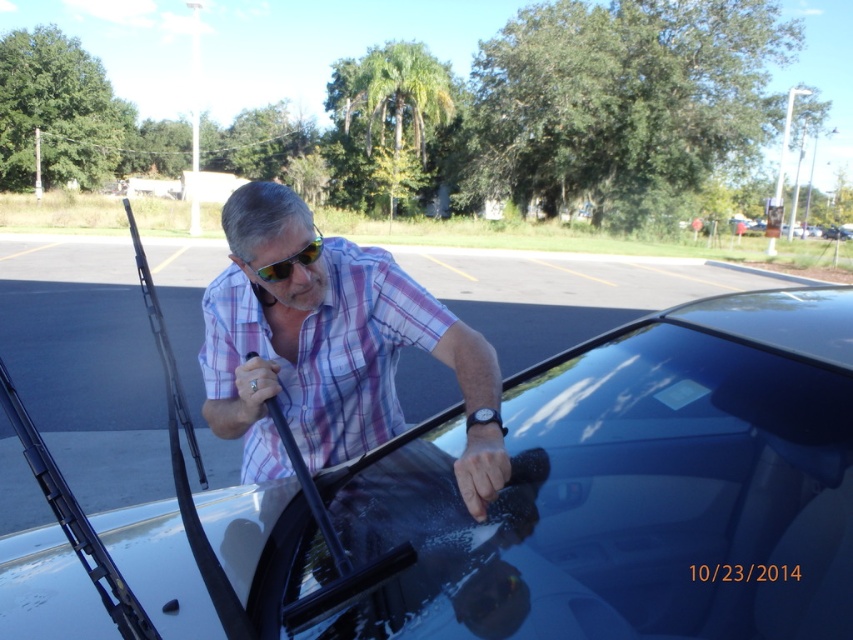
You are standing at the point marked as point (631, 488) in the image. What object are you directly facing?

The point (631, 488) is directly facing the glossy white car at center.

You are a fashion designer observing the man in the scene. You notice the plaid shirt at center and the yellow reflective lenses at center. Which item of clothing or accessory is bigger in size?

The plaid shirt at center is larger in size than the yellow reflective lenses at center.